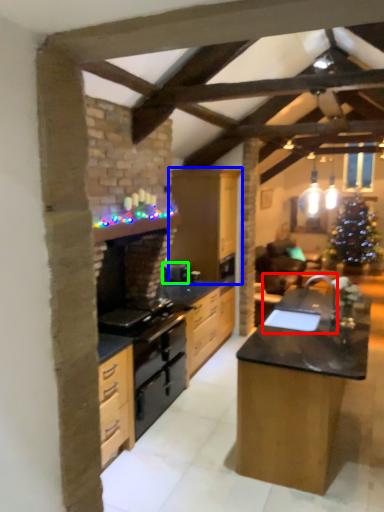
Question: Which object is the farthest from sink (highlighted by a red box)? Choose among these: cabinetry (highlighted by a blue box) or appliance (highlighted by a green box).

Choices:
 (A) cabinetry
 (B) appliance

Answer: (B)